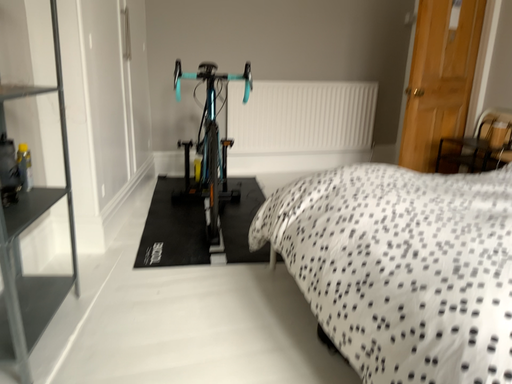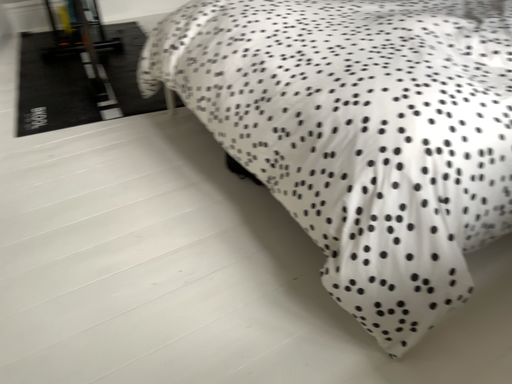
Question: How did the camera likely rotate when shooting the video?

Choices:
 (A) rotated downward
 (B) rotated upward

Answer: (A)